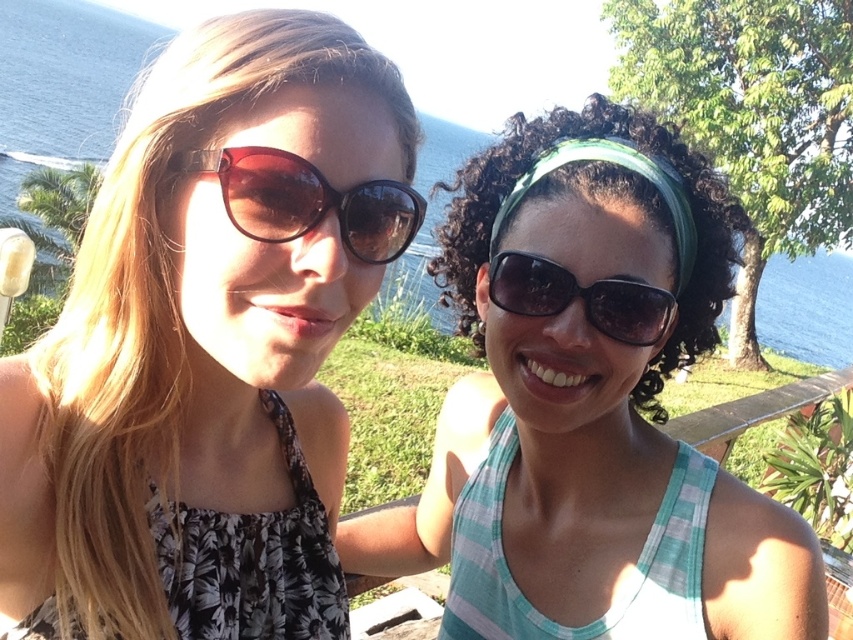
Can you confirm if green plaid tank top at center is shorter than brown glossy sunglasses at left?

No.

Is green plaid tank top at center smaller than brown glossy sunglasses at left?

Incorrect, green plaid tank top at center is not smaller in size than brown glossy sunglasses at left.

What do you see at coordinates (589, 406) in the screenshot? This screenshot has width=853, height=640. I see `green plaid tank top at center` at bounding box center [589, 406].

The image size is (853, 640). Find the location of `green plaid tank top at center`. green plaid tank top at center is located at coordinates (589, 406).

Who is positioned more to the left, matte black sunglasses at left or green plaid tank top at center?

From the viewer's perspective, matte black sunglasses at left appears more on the left side.

Who is lower down, matte black sunglasses at left or green plaid tank top at center?

Positioned lower is green plaid tank top at center.

Who is more distant from viewer, (305, 16) or (523, 284)?

The point (523, 284) is more distant.

In order to click on matte black sunglasses at left in this screenshot , I will do `click(207, 346)`.

How much distance is there between matte black sunglasses at left and brown glossy sunglasses at left?

A distance of 2.63 inches exists between matte black sunglasses at left and brown glossy sunglasses at left.

Between point (337, 420) and point (373, 218), which one is positioned behind?

The point (337, 420) is more distant.

This screenshot has height=640, width=853. I want to click on matte black sunglasses at left, so click(207, 346).

Find the location of a particular element. This screenshot has width=853, height=640. matte black sunglasses at left is located at coordinates (207, 346).